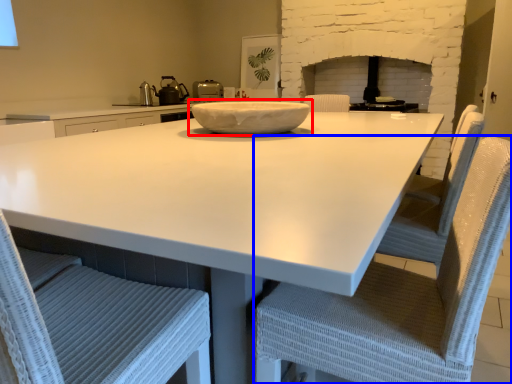
Question: Which point is closer to the camera, bowl (highlighted by a red box) or chair (highlighted by a blue box)?

Choices:
 (A) bowl
 (B) chair

Answer: (B)